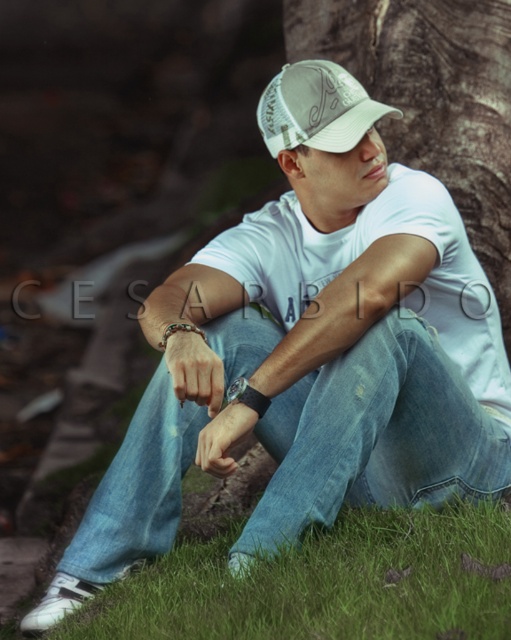
Question: Is denim jeans at center wider than green grass at lower center?

Choices:
 (A) no
 (B) yes

Answer: (B)

Question: Which is farther from the white cotton t-shirt at center?

Choices:
 (A) black leather bracelet at lower center
 (B) multicolored beaded bracelet at wrist

Answer: (B)

Question: Can you confirm if leather bracelet at lower center is positioned below multicolored beaded bracelet at wrist?

Choices:
 (A) yes
 (B) no

Answer: (A)

Question: Is the position of denim jeans at center less distant than that of smooth skin hand at center?

Choices:
 (A) no
 (B) yes

Answer: (A)

Question: Based on their relative distances, which object is farther from the multicolored beaded bracelet at wrist?

Choices:
 (A) black leather bracelet at lower center
 (B) white cotton t-shirt at center
 (C) green grass at lower center
 (D) white mesh cap at center

Answer: (C)

Question: Which point appears farthest from the camera in this image?

Choices:
 (A) (190, 330)
 (B) (442, 192)

Answer: (B)